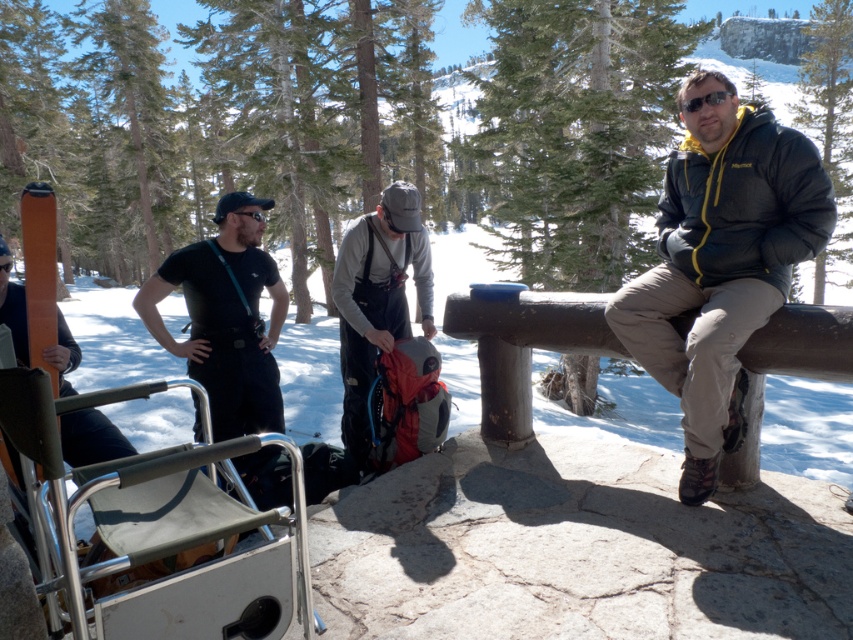
You are standing in the snowy mountain area and want to move from point A to point B. The coordinates for point A are point (x=764, y=189) and point B are point (x=358, y=236). Which point is closer to you?

Point (x=764, y=189) is closer to the viewer than point (x=358, y=236).

You are a photographer trying to capture a photo of the gray fabric backpack at center and the matte black jacket at right. You want to ensure both are in the frame. Based on their positions, which object should you position closer to the left side of your camera viewfinder to include both?

Since the matte black jacket at right is to the right of the gray fabric backpack at center, you should position the gray fabric backpack at center closer to the left side of your camera viewfinder so that the matte black jacket at right naturally falls to its right within the frame.

You are a photographer trying to capture a clear photo of the gray fabric backpack at center without the matte black jacket at right blocking it. How should you adjust your position?

Move to the left side so that the gray fabric backpack at center is no longer obscured by the matte black jacket at right, which is currently positioned over it.